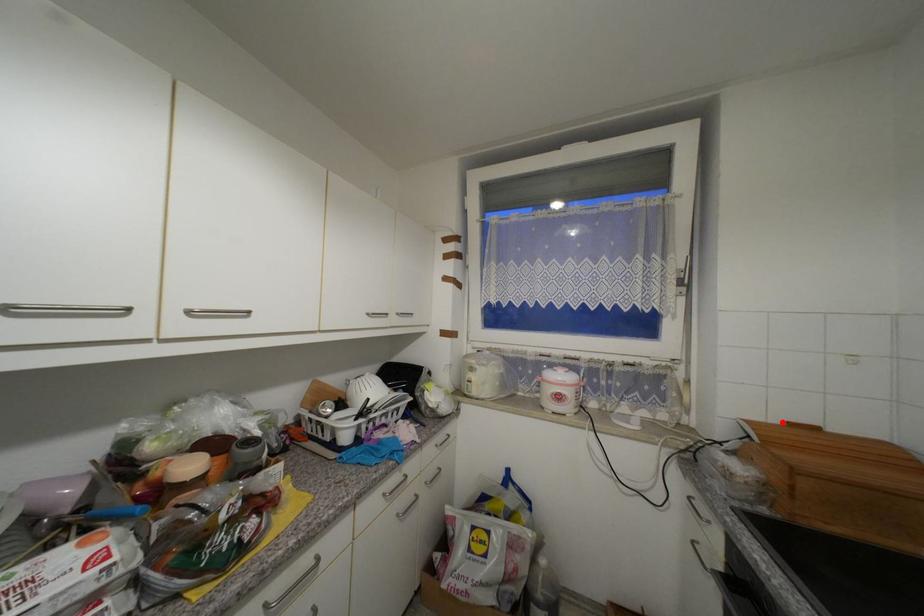
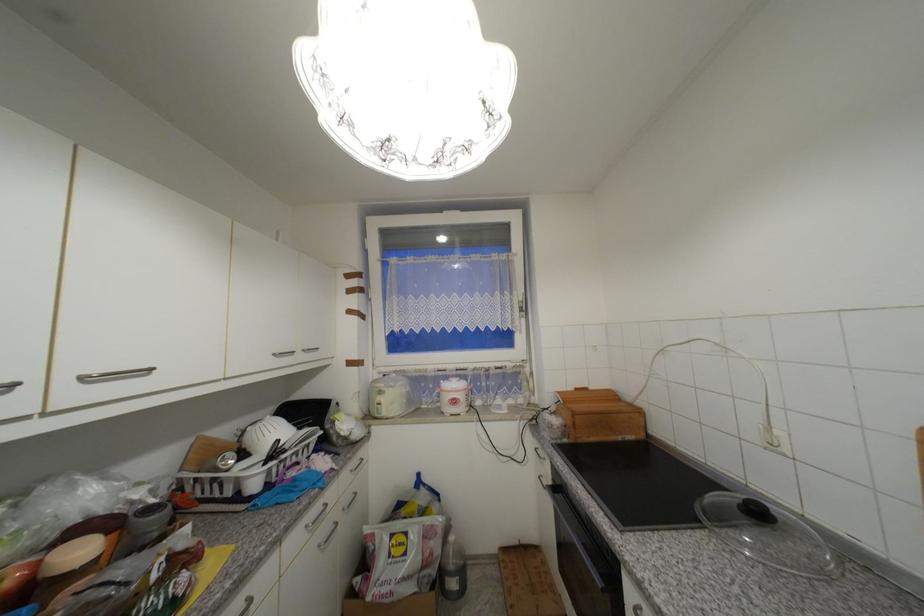
Locate, in the second image, the point that corresponds to the highlighted location in the first image.

(576, 390)